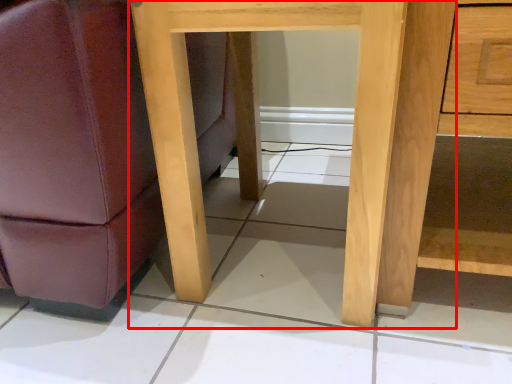
Question: From the image's perspective, where is table (annotated by the red box) located relative to dresser?

Choices:
 (A) below
 (B) above

Answer: (A)